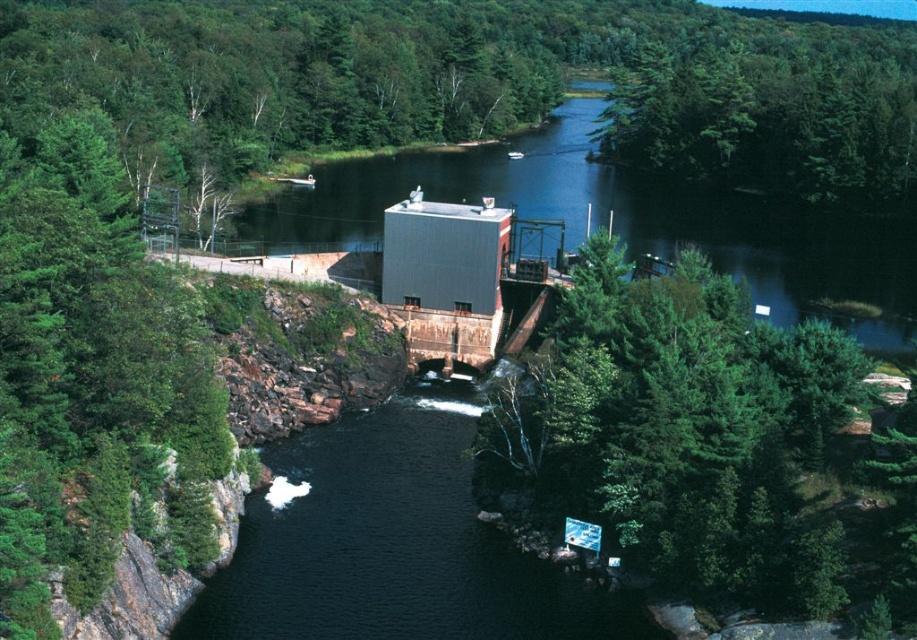
Between smooth concrete dam at center and green leafy trees at upper right, which one has less height?

With less height is smooth concrete dam at center.

Is point (818, 236) positioned after point (774, 26)?

No, it is not.

Is point (396, 154) less distant than point (679, 81)?

No.

You are a GUI agent. You are given a task and a screenshot of the screen. Output one action in this format:
    pyautogui.click(x=<x>, y=<y>)
    Task: Click on the smooth concrete dam at center
    
    Given the screenshot: What is the action you would take?
    pyautogui.click(x=625, y=221)

Is point (808, 547) more distant than point (709, 136)?

No, it is not.

Between green leafy tree at center and green leafy trees at upper right, which one appears on the right side from the viewer's perspective?

green leafy trees at upper right is more to the right.

Is point (873, 582) closer to camera compared to point (868, 184)?

That is True.

Where is `green leafy tree at center`? This screenshot has width=917, height=640. green leafy tree at center is located at coordinates (682, 433).

Can you confirm if green leafy tree at center is wider than smooth concrete dam at center?

No, green leafy tree at center is not wider than smooth concrete dam at center.

From the picture: Does green leafy tree at center appear under smooth concrete dam at center?

Yes.

Is point (838, 536) positioned before point (538, 166)?

Yes, point (838, 536) is in front of point (538, 166).

I want to click on green leafy tree at center, so click(682, 433).